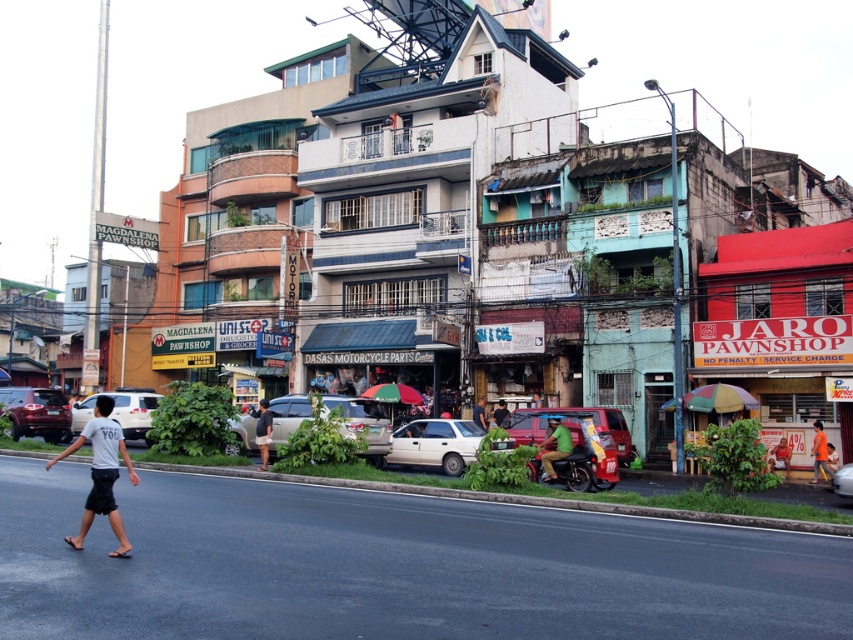
Can you confirm if orange shirt at center is positioned below dark green shirt at center?

Yes.

Who is more distant from viewer, (782,449) or (502,419)?

Positioned behind is point (502,419).

This screenshot has width=853, height=640. I want to click on orange shirt at center, so click(x=779, y=456).

Between point (395, 449) and point (561, 458), which one is positioned behind?

Point (395, 449)

Who is more forward, (485, 433) or (544, 458)?

Point (544, 458) is in front.

Is point (463, 433) behind point (570, 452)?

Yes.

Find the location of a particular element. This screenshot has height=640, width=853. white matte sedan at center is located at coordinates (436, 444).

Is point (120, 433) closer to viewer compared to point (525, 429)?

That is True.

Which is in front, point (102, 451) or point (607, 451)?

Point (102, 451)

This screenshot has height=640, width=853. What do you see at coordinates (102, 474) in the screenshot? I see `white cotton shirt at left` at bounding box center [102, 474].

Identify the location of white cotton shirt at left. tap(102, 474).